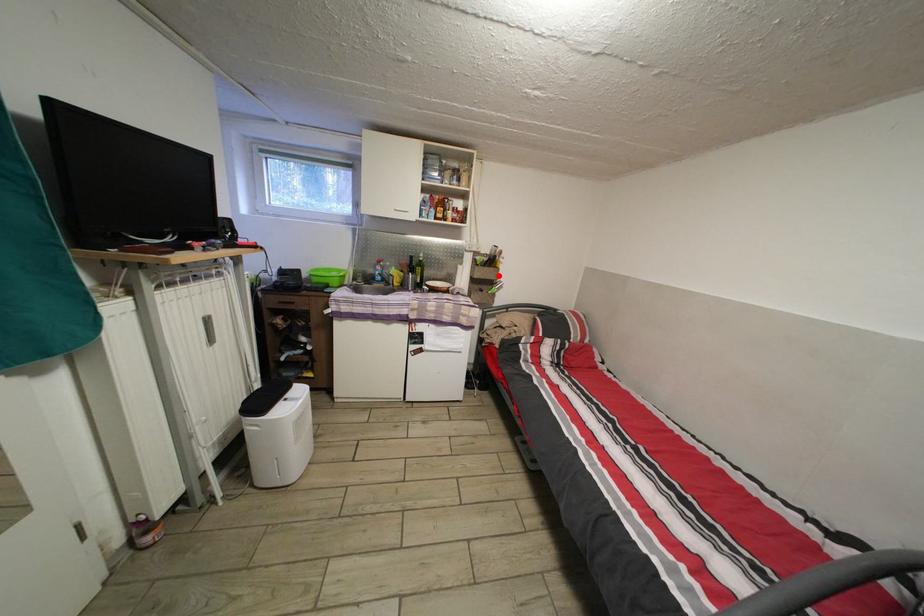
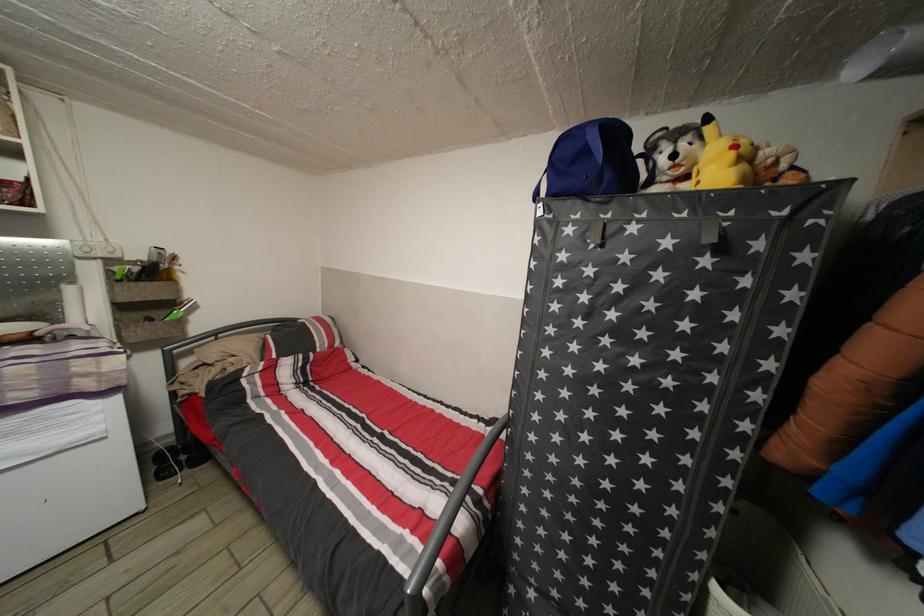
Question: I am providing you with two images of the same scene from different viewpoints. A red point is shown in image1. For the corresponding object point in image2, is it positioned nearer or farther from the camera?

Choices:
 (A) Nearer
 (B) Farther

Answer: (B)